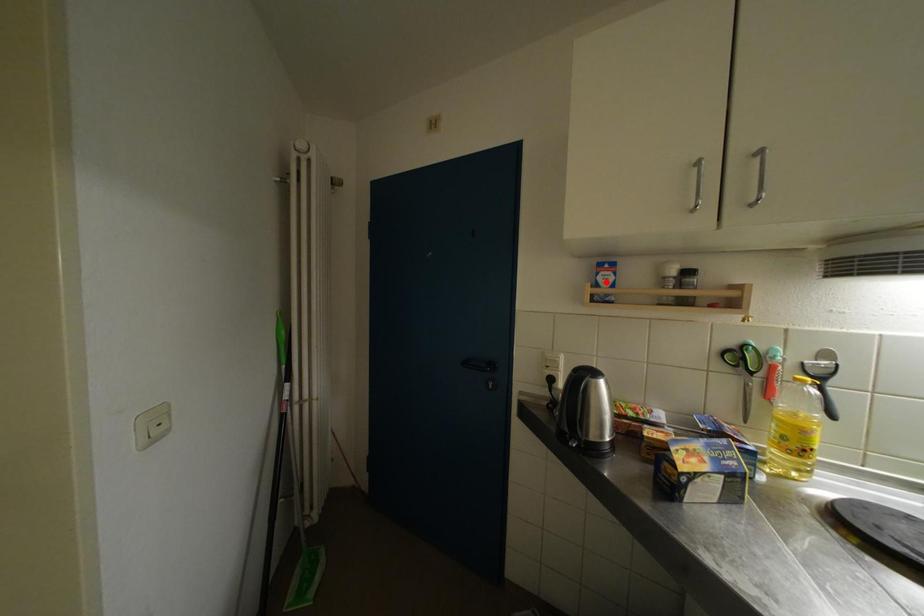
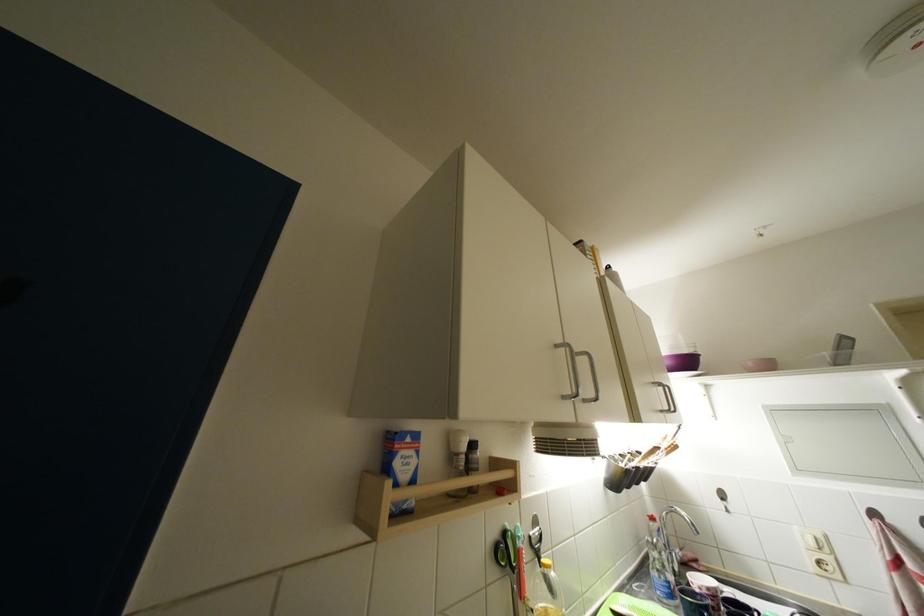
Where in the second image is the point corresponding to the highlighted location from the first image?

(404, 467)